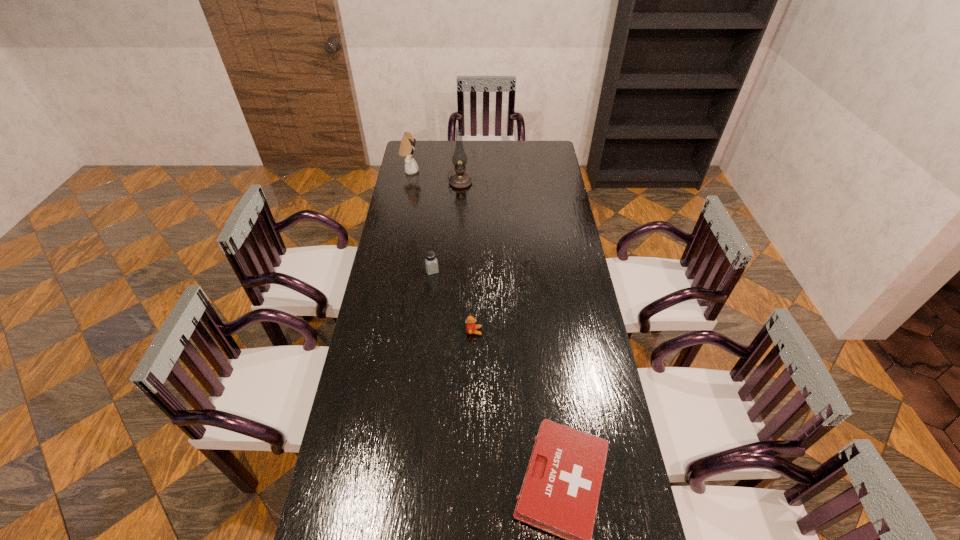
Locate an element on the screen. object located in the far edge section of the desktop is located at coordinates (407, 145).

This screenshot has width=960, height=540. I want to click on object that is at the left edge, so click(407, 145).

Find the location of a particular element. object that is positioned at the far left corner is located at coordinates (407, 145).

You are a GUI agent. You are given a task and a screenshot of the screen. Output one action in this format:
    pyautogui.click(x=<x>, y=<y>)
    Task: Click on the vacant space at the far edge of the desktop
    The width and height of the screenshot is (960, 540).
    Given the screenshot: What is the action you would take?
    pyautogui.click(x=441, y=164)

In the image, there is a desktop. What are the coordinates of `free space at the right edge` in the screenshot? It's located at (549, 186).

This screenshot has width=960, height=540. Identify the location of free spot between the teddy bear and the oil lamp. (468, 257).

At what (x,y) coordinates should I click in order to perform the action: click on vacant area that lies between the teddy bear and the second object from left to right. Please return your answer as a coordinate pair (x, y). The height and width of the screenshot is (540, 960). Looking at the image, I should click on (453, 301).

I want to click on blank region between the leftmost object and the teddy bear, so click(442, 251).

Locate an element on the screen. The height and width of the screenshot is (540, 960). vacant space that is in between the teddy bear and the tallest object is located at coordinates (468, 257).

This screenshot has width=960, height=540. In order to click on free space between the tallest object and the second nearest object in this screenshot , I will do `click(468, 257)`.